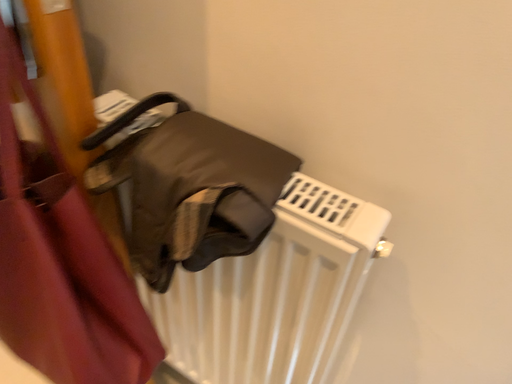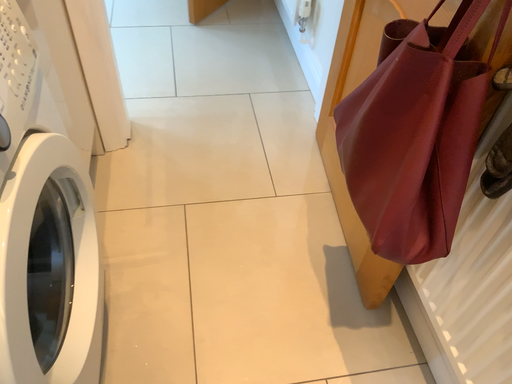
Question: How did the camera likely rotate when shooting the video?

Choices:
 (A) rotated upward
 (B) rotated downward

Answer: (A)